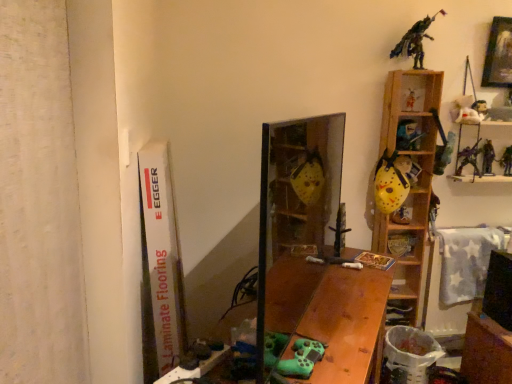
Question: Should I look upward or downward to see metallic silver toy at upper right, arranged as the 1th toy when viewed from the right?

Choices:
 (A) down
 (B) up

Answer: (B)

Question: Does metallic silver toy at upper right, which is the twelfth toy in left-to-right order, have a larger size compared to metallic figure at upper right, acting as the fourth toy starting from the left?

Choices:
 (A) no
 (B) yes

Answer: (A)

Question: From the image's perspective, is metallic silver toy at upper right, arranged as the 1th toy when viewed from the right, on metallic figure at upper right, acting as the fourth toy starting from the left?

Choices:
 (A) yes
 (B) no

Answer: (B)

Question: Is metallic silver toy at upper right, which is the twelfth toy in left-to-right order, far from metallic figure at upper right, positioned as the ninth toy in right-to-left order?

Choices:
 (A) yes
 (B) no

Answer: (B)

Question: Is metallic silver toy at upper right, arranged as the 1th toy when viewed from the right, wider than metallic figure at upper right, acting as the fourth toy starting from the left?

Choices:
 (A) no
 (B) yes

Answer: (A)

Question: Is metallic silver toy at upper right, arranged as the 1th toy when viewed from the right, facing towards metallic figure at upper right, acting as the fourth toy starting from the left?

Choices:
 (A) no
 (B) yes

Answer: (A)

Question: Considering the relative sizes of metallic silver toy at upper right, arranged as the 1th toy when viewed from the right, and metallic figure at upper right, positioned as the ninth toy in right-to-left order, in the image provided, is metallic silver toy at upper right, arranged as the 1th toy when viewed from the right, thinner than metallic figure at upper right, positioned as the ninth toy in right-to-left order,?

Choices:
 (A) no
 (B) yes

Answer: (B)

Question: Are wooden picture frame at upper right and metallic silver toy at upper right, arranged as the 1th toy when viewed from the right, located far from each other?

Choices:
 (A) yes
 (B) no

Answer: (B)

Question: Is wooden picture frame at upper right closer to camera compared to metallic silver toy at upper right, arranged as the 1th toy when viewed from the right?

Choices:
 (A) no
 (B) yes

Answer: (B)

Question: Is wooden picture frame at upper right thinner than metallic silver toy at upper right, arranged as the 1th toy when viewed from the right?

Choices:
 (A) yes
 (B) no

Answer: (B)

Question: Considering the relative sizes of wooden picture frame at upper right and metallic silver toy at upper right, arranged as the 1th toy when viewed from the right, in the image provided, is wooden picture frame at upper right smaller than metallic silver toy at upper right, arranged as the 1th toy when viewed from the right,?

Choices:
 (A) no
 (B) yes

Answer: (A)

Question: Could metallic silver toy at upper right, which is the twelfth toy in left-to-right order, be considered to be inside wooden picture frame at upper right?

Choices:
 (A) no
 (B) yes

Answer: (A)

Question: Would you say wooden picture frame at upper right is outside metallic silver toy at upper right, which is the twelfth toy in left-to-right order?

Choices:
 (A) yes
 (B) no

Answer: (A)

Question: Is yellow matte hockey mask at upper right, which is the seventh toy in right-to-left order, thinner than yellow matte hockey mask at right, placed as the 10th toy when sorted from right to left?

Choices:
 (A) no
 (B) yes

Answer: (B)